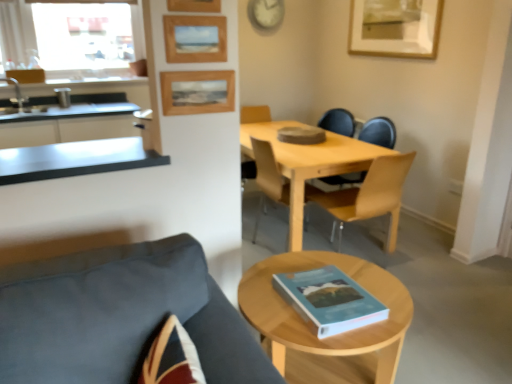
Question: Is satin steel countertop at left facing towards wooden picture frame at upper right, arranged as the fourth picture frame when ordered from the bottom?

Choices:
 (A) yes
 (B) no

Answer: (B)

Question: Does satin steel countertop at left have a lesser height compared to wooden picture frame at upper right, the first picture frame positioned from the back?

Choices:
 (A) yes
 (B) no

Answer: (A)

Question: Does satin steel countertop at left appear on the left side of wooden picture frame at upper right, which is the first picture frame from right to left?

Choices:
 (A) no
 (B) yes

Answer: (B)

Question: Would you consider satin steel countertop at left to be distant from wooden picture frame at upper right, the first picture frame positioned from the back?

Choices:
 (A) no
 (B) yes

Answer: (B)

Question: Can you confirm if satin steel countertop at left is thinner than wooden picture frame at upper right, which is the first picture frame from right to left?

Choices:
 (A) yes
 (B) no

Answer: (B)

Question: From the image's perspective, is satin steel countertop at left on top of wooden picture frame at upper right, arranged as the 4th picture frame when viewed from the front?

Choices:
 (A) yes
 (B) no

Answer: (B)

Question: Can you confirm if wooden picture frame at upper center, which is counted as the 2th picture frame, starting from the bottom, is thinner than satin steel countertop at left?

Choices:
 (A) yes
 (B) no

Answer: (A)

Question: Does wooden picture frame at upper center, the first picture frame viewed from the left, contain satin steel countertop at left?

Choices:
 (A) yes
 (B) no

Answer: (B)

Question: From the image's perspective, is wooden picture frame at upper center, which appears as the 3th picture frame when viewed from the top, beneath satin steel countertop at left?

Choices:
 (A) no
 (B) yes

Answer: (A)

Question: Is wooden picture frame at upper center, which appears as the 3th picture frame when viewed from the top, to the right of satin steel countertop at left from the viewer's perspective?

Choices:
 (A) no
 (B) yes

Answer: (B)

Question: Considering the relative sizes of wooden picture frame at upper center, the third picture frame from the back, and satin steel countertop at left in the image provided, is wooden picture frame at upper center, the third picture frame from the back, taller than satin steel countertop at left?

Choices:
 (A) no
 (B) yes

Answer: (A)

Question: Is wooden picture frame at upper center, positioned as the 2th picture frame in front-to-back order, further to camera compared to satin steel countertop at left?

Choices:
 (A) no
 (B) yes

Answer: (A)

Question: Is dark gray fabric chair at lower left, acting as the first chair starting from the front, to the left of light wood table at center from the viewer's perspective?

Choices:
 (A) yes
 (B) no

Answer: (A)